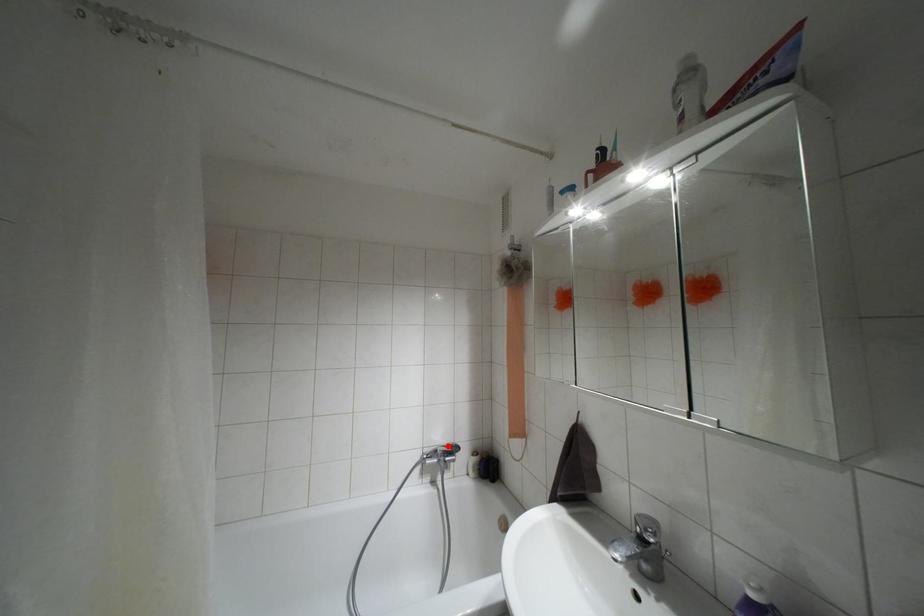
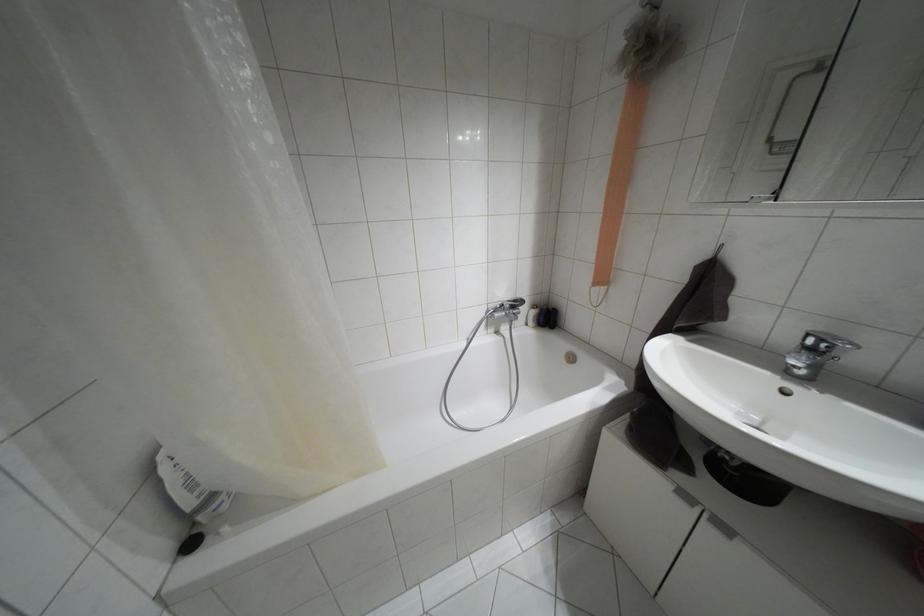
Question: A red point is marked in image1. In image2, is the corresponding 3D point closer to the camera or farther? Reply with the corresponding letter.

Choices:
 (A) The corresponding 3D point is closer.
 (B) The corresponding 3D point is farther.

Answer: (A)